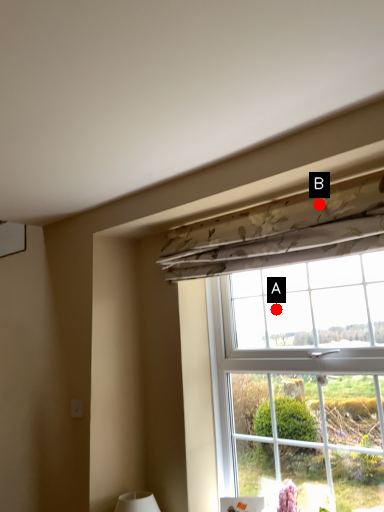
Question: Two points are circled on the image, labeled by A and B beside each circle. Which point is closer to the camera?

Choices:
 (A) A is closer
 (B) B is closer

Answer: (B)